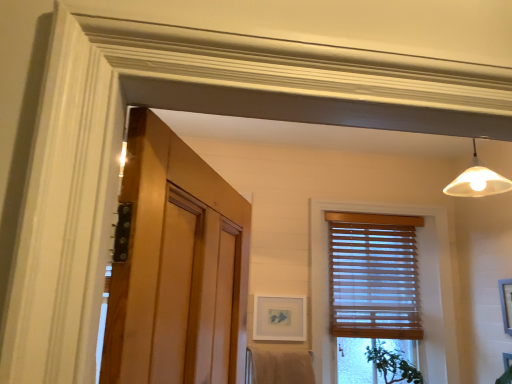
Question: Is green leafy plant at lower right bigger than wooden blinds at center?

Choices:
 (A) yes
 (B) no

Answer: (B)

Question: Is green leafy plant at lower right taller than wooden blinds at center?

Choices:
 (A) no
 (B) yes

Answer: (A)

Question: Is green leafy plant at lower right positioned behind wooden blinds at center?

Choices:
 (A) no
 (B) yes

Answer: (A)

Question: Is green leafy plant at lower right oriented towards wooden blinds at center?

Choices:
 (A) yes
 (B) no

Answer: (A)

Question: Is green leafy plant at lower right positioned before wooden blinds at center?

Choices:
 (A) no
 (B) yes

Answer: (B)

Question: Is green leafy plant at lower right to the left of wooden blinds at center from the viewer's perspective?

Choices:
 (A) yes
 (B) no

Answer: (B)

Question: Is beige cotton bath towel at lower center taller than white matte picture frame at right, which is the second picture frame in left-to-right order?

Choices:
 (A) no
 (B) yes

Answer: (A)

Question: From a real-world perspective, is beige cotton bath towel at lower center located higher than white matte picture frame at right, which is the second picture frame in left-to-right order?

Choices:
 (A) yes
 (B) no

Answer: (B)

Question: Is white matte picture frame at right, acting as the first picture frame starting from the right, inside beige cotton bath towel at lower center?

Choices:
 (A) yes
 (B) no

Answer: (B)

Question: Is beige cotton bath towel at lower center further to the viewer compared to white matte picture frame at right, which is the second picture frame in left-to-right order?

Choices:
 (A) yes
 (B) no

Answer: (A)

Question: Is beige cotton bath towel at lower center completely or partially outside of white matte picture frame at right, acting as the first picture frame starting from the right?

Choices:
 (A) no
 (B) yes

Answer: (B)

Question: Is beige cotton bath towel at lower center looking in the opposite direction of white matte picture frame at right, acting as the first picture frame starting from the right?

Choices:
 (A) no
 (B) yes

Answer: (A)

Question: Does beige cotton bath towel at lower center have a lesser height compared to green leafy plant at lower right?

Choices:
 (A) yes
 (B) no

Answer: (A)